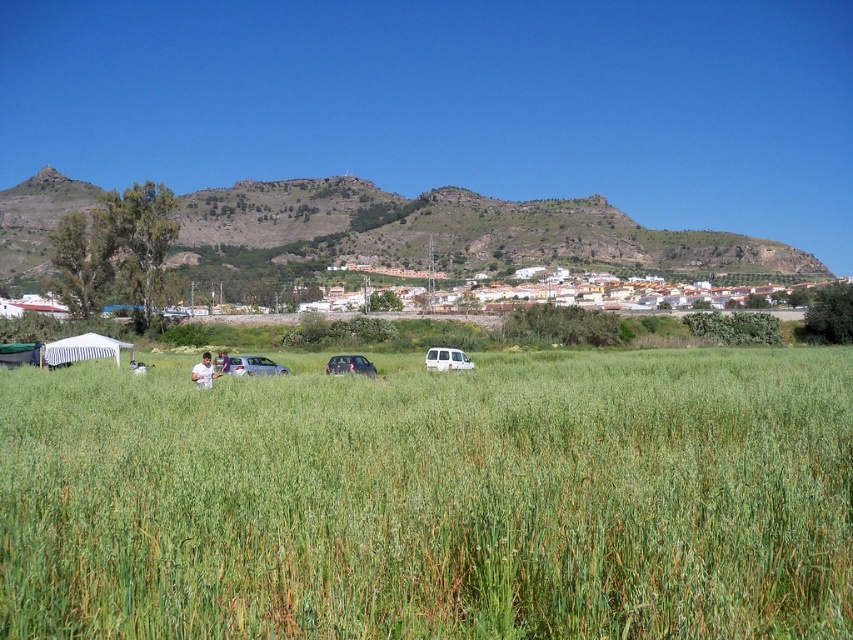
Question: Observing the image, what is the correct spatial positioning of green grassy field at center in reference to white striped tent at lower left?

Choices:
 (A) right
 (B) left

Answer: (A)

Question: Which object is positioned farthest from the white matte van at center?

Choices:
 (A) silver metallic car at center
 (B) green grassy field at center
 (C) metallic silver car at center

Answer: (B)

Question: Which of these objects is positioned farthest from the metallic silver car at center?

Choices:
 (A) white striped tent at lower left
 (B) white fabric at lower center
 (C) green grassy field at center

Answer: (C)

Question: Is the position of white matte van at center less distant than that of metallic silver car at center?

Choices:
 (A) yes
 (B) no

Answer: (A)

Question: Which of the following is the closest to the observer?

Choices:
 (A) silver metallic car at center
 (B) white striped tent at lower left

Answer: (A)

Question: Does green grassy field at center have a smaller size compared to white fabric at lower center?

Choices:
 (A) yes
 (B) no

Answer: (B)